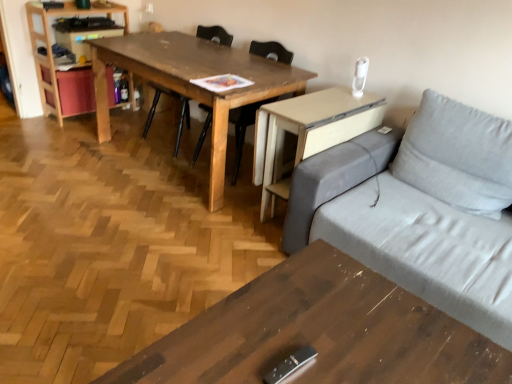
Where is `vacant area in front of wooden table at center, which is counted as the 2th table, starting from the bottom`? vacant area in front of wooden table at center, which is counted as the 2th table, starting from the bottom is located at coordinates (132, 231).